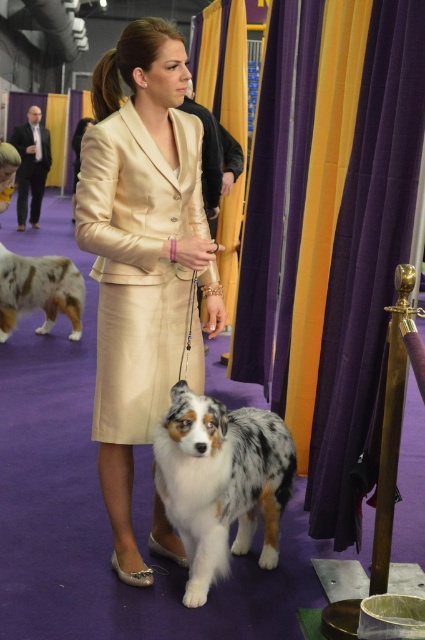
Question: Does gold shiny suit at center come in front of white and brown fur at center?

Choices:
 (A) yes
 (B) no

Answer: (A)

Question: Considering the real-world distances, which object is farthest from the white and brown fur at center?

Choices:
 (A) gold shiny suit at center
 (B) matte black suit at left
 (C) spotted fur dog at center

Answer: (B)

Question: Does gold shiny suit at center have a lesser width compared to matte black suit at left?

Choices:
 (A) no
 (B) yes

Answer: (B)

Question: Which of the following is the closest to the observer?

Choices:
 (A) gold shiny suit at center
 (B) spotted fur dog at center

Answer: (B)

Question: Which object is positioned closest to the matte black suit at left?

Choices:
 (A) gold shiny suit at center
 (B) white and brown fur at center
 (C) spotted fur dog at center

Answer: (B)

Question: Does gold shiny suit at center appear on the right side of spotted fur dog at center?

Choices:
 (A) no
 (B) yes

Answer: (A)